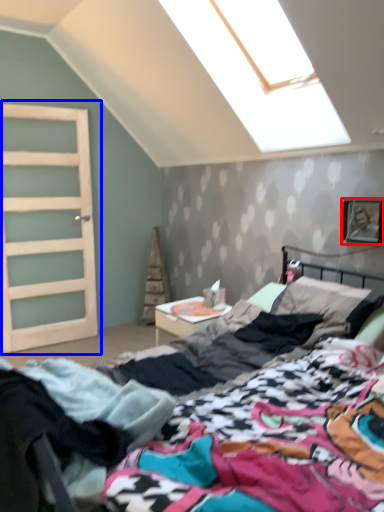
Question: Which object is closer to the camera taking this photo, picture frame (highlighted by a red box) or door (highlighted by a blue box)?

Choices:
 (A) picture frame
 (B) door

Answer: (A)